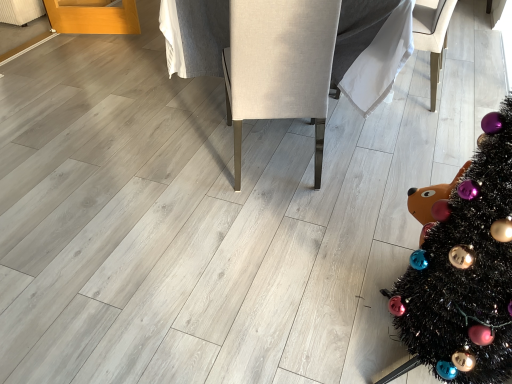
The image size is (512, 384). Find the location of `free space in front of beige fabric armchair at center, the 2th armchair viewed from the right`. free space in front of beige fabric armchair at center, the 2th armchair viewed from the right is located at coordinates (255, 238).